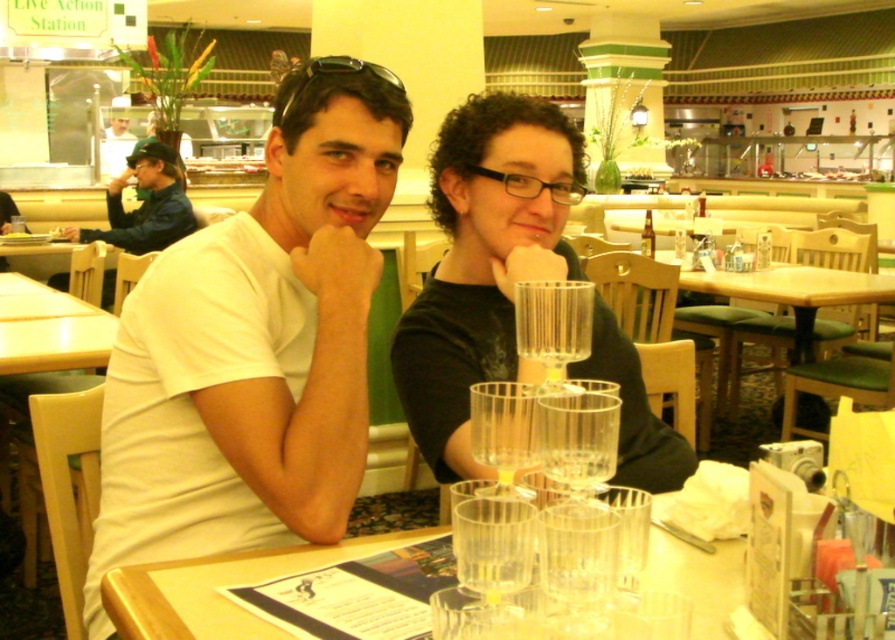
You are a server at the restaurant and need to place a new order of drinks on the table. The drinks require 36 inches of space. Can you fit them between the clear glass at center and the sunglasses at center?

The clear glass at center is 30.45 inches away from the sunglasses at center. Since the required space is 36 inches, which is greater than the available distance, the drinks cannot be placed between them.